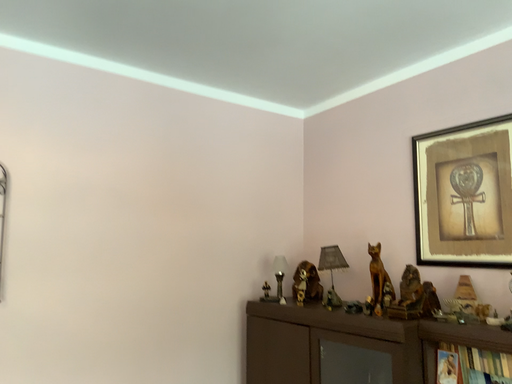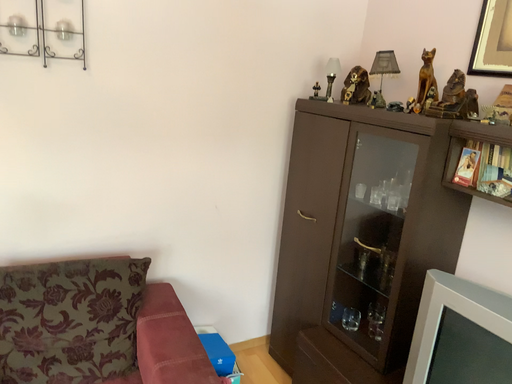
Question: How did the camera likely rotate when shooting the video?

Choices:
 (A) rotated right
 (B) rotated left

Answer: (B)